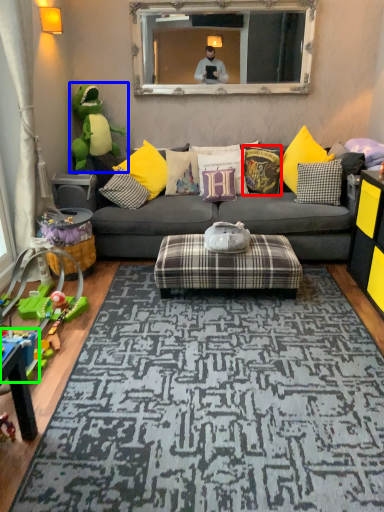
Question: Which is farther away from pillow (highlighted by a red box)? toy (highlighted by a blue box) or toy (highlighted by a green box)?

Choices:
 (A) toy
 (B) toy

Answer: (B)